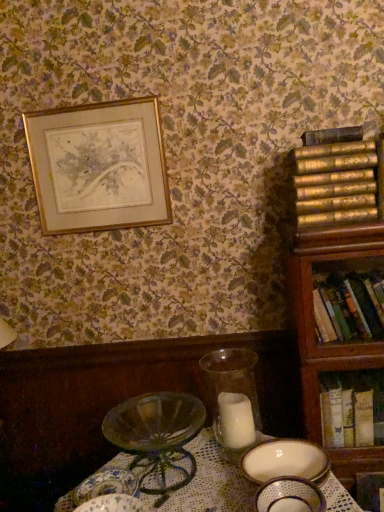
Question: From a real-world perspective, is translucent glass candle at center under gold textured books at right, the 3th book ordered from the bottom?

Choices:
 (A) no
 (B) yes

Answer: (B)

Question: Considering the relative sizes of translucent glass candle at center and gold textured books at right, the 3th book ordered from the bottom, in the image provided, is translucent glass candle at center shorter than gold textured books at right, the 3th book ordered from the bottom,?

Choices:
 (A) yes
 (B) no

Answer: (A)

Question: From a real-world perspective, is translucent glass candle at center physically above gold textured books at right, which appears as the 1th book when viewed from the top?

Choices:
 (A) yes
 (B) no

Answer: (B)

Question: Does translucent glass candle at center appear on the left side of gold textured books at right, the 3th book ordered from the bottom?

Choices:
 (A) yes
 (B) no

Answer: (A)

Question: Does translucent glass candle at center come in front of gold textured books at right, the 3th book ordered from the bottom?

Choices:
 (A) no
 (B) yes

Answer: (B)

Question: Does translucent glass candle at center have a greater height compared to gold textured books at right, which appears as the 1th book when viewed from the top?

Choices:
 (A) yes
 (B) no

Answer: (B)

Question: Is wooden bookcase at right not within gold textured books at right, which appears as the 1th book when viewed from the top?

Choices:
 (A) yes
 (B) no

Answer: (A)

Question: Is gold textured books at right, the 3th book ordered from the bottom, located within wooden bookcase at right?

Choices:
 (A) yes
 (B) no

Answer: (B)

Question: From a real-world perspective, is wooden bookcase at right positioned over gold textured books at right, the 3th book ordered from the bottom, based on gravity?

Choices:
 (A) yes
 (B) no

Answer: (B)

Question: Is there a large distance between wooden bookcase at right and gold textured books at right, which appears as the 1th book when viewed from the top?

Choices:
 (A) no
 (B) yes

Answer: (A)

Question: Can you confirm if wooden bookcase at right is taller than gold textured books at right, the 3th book ordered from the bottom?

Choices:
 (A) yes
 (B) no

Answer: (A)

Question: Can you confirm if wooden bookcase at right is smaller than gold textured books at right, which appears as the 1th book when viewed from the top?

Choices:
 (A) yes
 (B) no

Answer: (B)

Question: Would you say gold textured books at right, which appears as the 1th book when viewed from the top, is outside porcelain bowl at lower center, acting as the second tableware starting from the back?

Choices:
 (A) yes
 (B) no

Answer: (A)